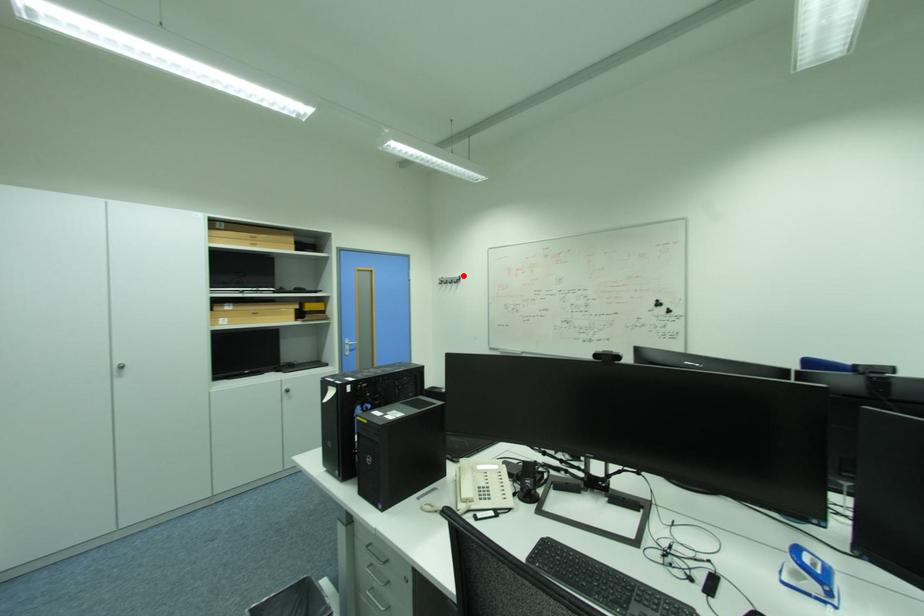
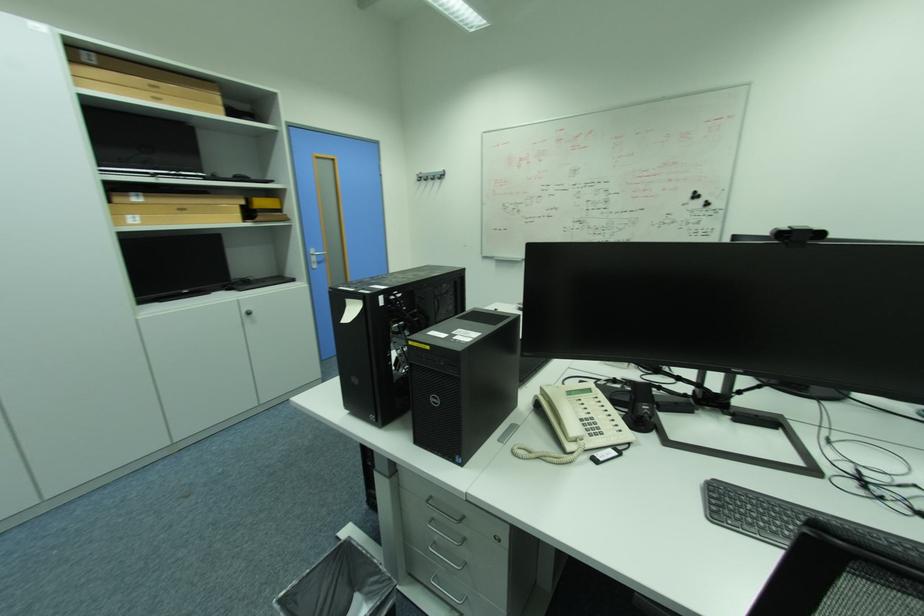
Locate, in the second image, the point that corresponds to the highlighted location in the first image.

(444, 169)